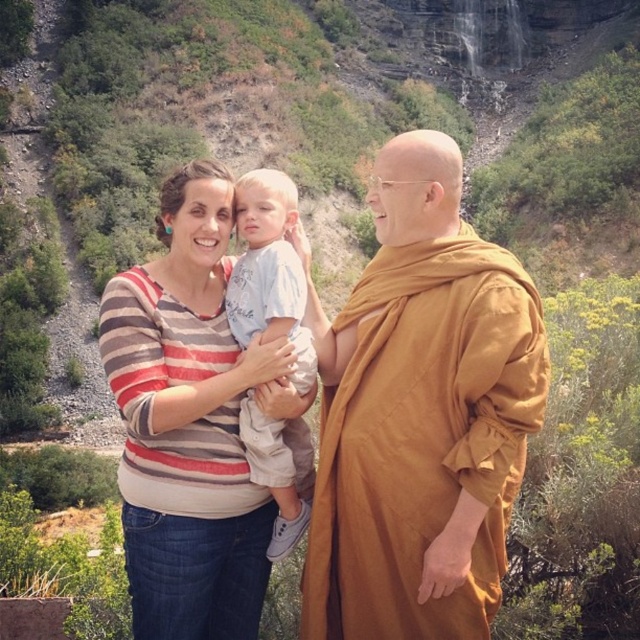
Question: Which point is closer to the camera?

Choices:
 (A) brown clothed monk at right
 (B) striped fabric shirt at center
 (C) light blue cotton shirt at center

Answer: (A)

Question: Is brown clothed monk at right to the left of light blue cotton shirt at center from the viewer's perspective?

Choices:
 (A) yes
 (B) no

Answer: (B)

Question: Can you confirm if brown clothed monk at right is bigger than light blue cotton shirt at center?

Choices:
 (A) yes
 (B) no

Answer: (A)

Question: Considering the real-world distances, which object is farthest from the brown clothed monk at right?

Choices:
 (A) striped fabric shirt at center
 (B) light blue cotton shirt at center

Answer: (A)

Question: Is brown clothed monk at right to the right of striped fabric shirt at center from the viewer's perspective?

Choices:
 (A) no
 (B) yes

Answer: (B)

Question: Among these points, which one is nearest to the camera?

Choices:
 (A) (268, 381)
 (B) (460, 224)
 (C) (259, 429)

Answer: (C)